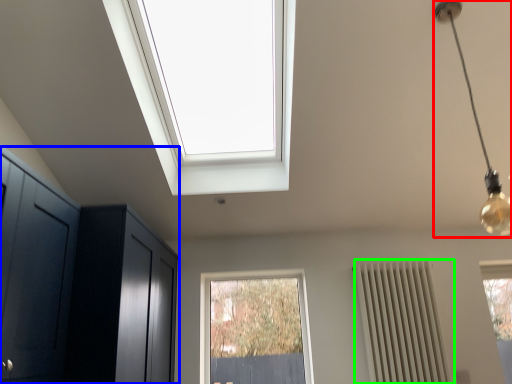
Question: Which object is positioned closest to light fixture (highlighted by a red box)? Select from dresser (highlighted by a blue box) and radiator (highlighted by a green box).

Choices:
 (A) dresser
 (B) radiator

Answer: (B)